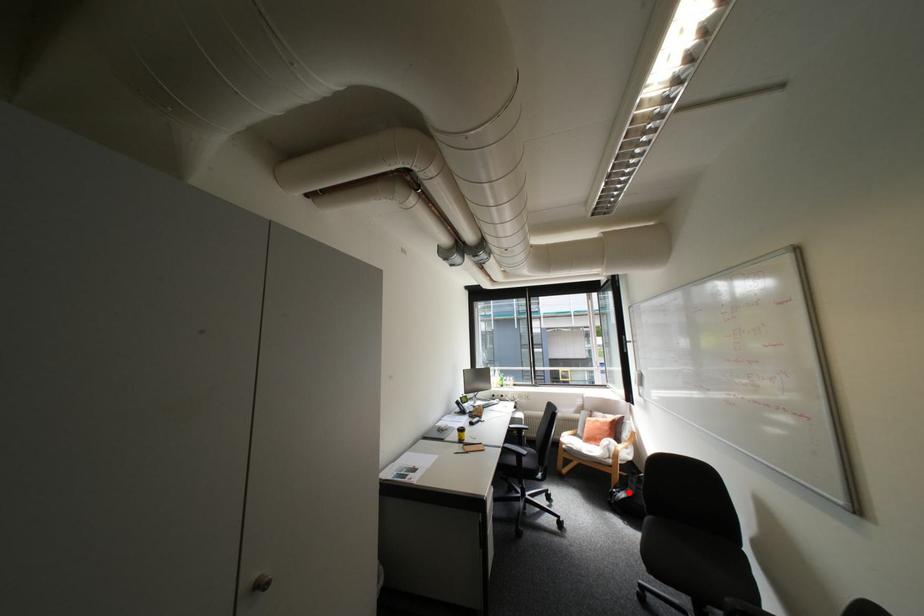
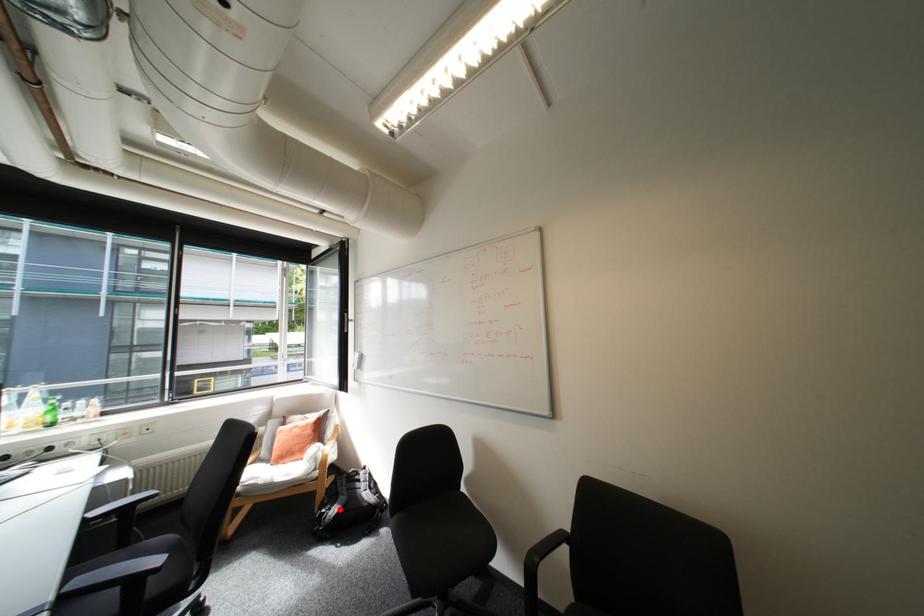
I am providing you with two images of the same scene from different viewpoints. A red point is marked on the first image and another point is marked on the second image. Is the red point in image1 aligned with the point shown in image2?

Yes